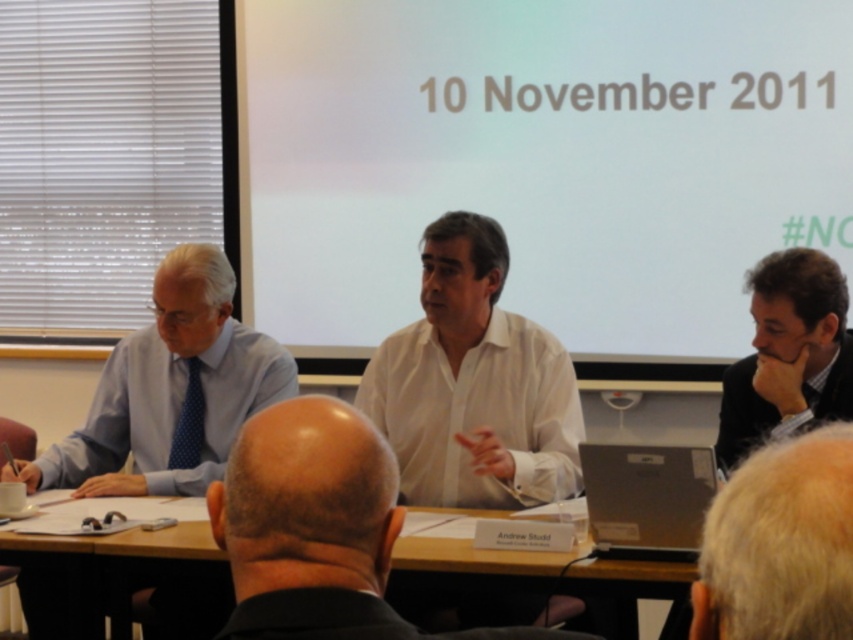
Question: Which point appears farthest from the camera in this image?

Choices:
 (A) (326, 396)
 (B) (772, 296)
 (C) (131, 376)
 (D) (724, 627)

Answer: (C)

Question: Can you confirm if light blue shirt at left is bigger than wooden table at center?

Choices:
 (A) no
 (B) yes

Answer: (B)

Question: Can you confirm if gray hair at upper center is positioned above wooden table at center?

Choices:
 (A) yes
 (B) no

Answer: (A)

Question: Which point is farther to the camera?

Choices:
 (A) (584, 588)
 (B) (577, 442)

Answer: (B)

Question: Does light blue shirt at left have a smaller size compared to dark brown hair at right?

Choices:
 (A) no
 (B) yes

Answer: (A)

Question: Which point appears farthest from the camera in this image?

Choices:
 (A) (424, 632)
 (B) (846, 397)
 (C) (822, 561)

Answer: (B)